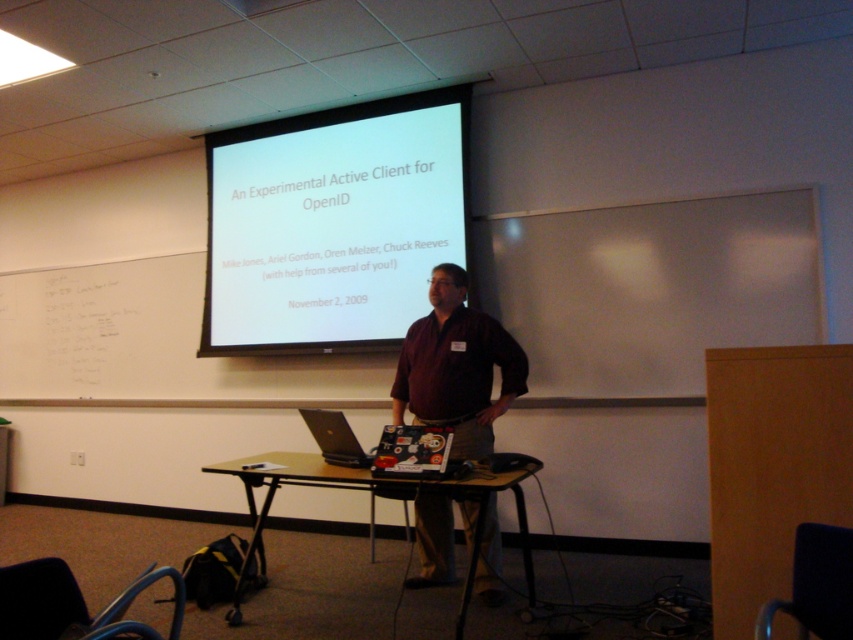
Question: Does white matte projector screen at upper center appear under brown matte shirt at center?

Choices:
 (A) yes
 (B) no

Answer: (B)

Question: Which point is farther to the camera?

Choices:
 (A) silver metallic laptop at center
 (B) brown wooden table at center

Answer: (A)

Question: Is white matte projector screen at upper center to the right of brown wooden table at center from the viewer's perspective?

Choices:
 (A) no
 (B) yes

Answer: (A)

Question: From the image, what is the correct spatial relationship of brown wooden table at center in relation to silver metallic laptop at center?

Choices:
 (A) above
 (B) below

Answer: (B)

Question: Among these objects, which one is nearest to the camera?

Choices:
 (A) silver metallic laptop at center
 (B) white matte projector screen at upper center
 (C) brown wooden table at center

Answer: (C)

Question: Among these points, which one is farthest from the camera?

Choices:
 (A) (364, 490)
 (B) (318, 323)

Answer: (B)